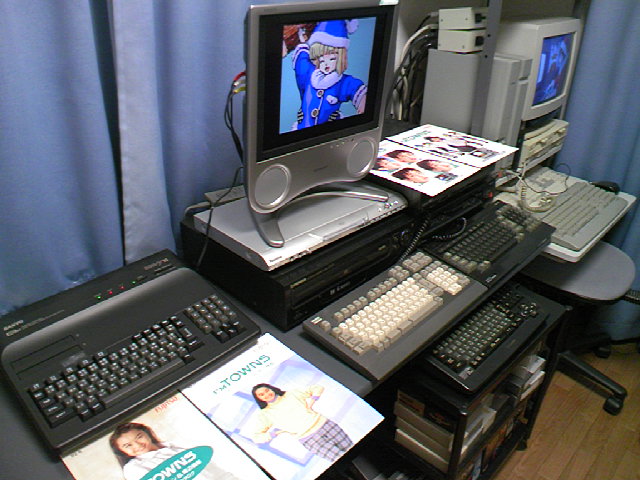
Where is `lights`? This screenshot has width=640, height=480. lights is located at coordinates (96, 296), (113, 288), (125, 286), (134, 283).